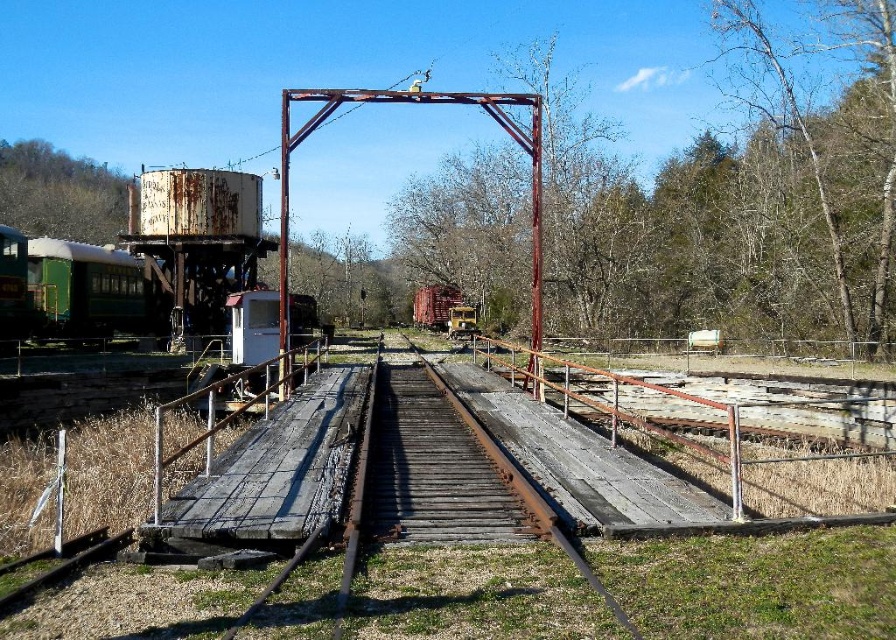
In the scene shown: Can you confirm if green painted metal train car at left is taller than rusty metal train car at center?

Incorrect, green painted metal train car at left's height is not larger of rusty metal train car at center's.

Is green painted metal train car at left below rusty metal train car at center?

Yes.

At what (x,y) coordinates should I click in order to perform the action: click on green painted metal train car at left. Please return your answer as a coordinate pair (x, y). The height and width of the screenshot is (640, 896). Looking at the image, I should click on (67, 289).